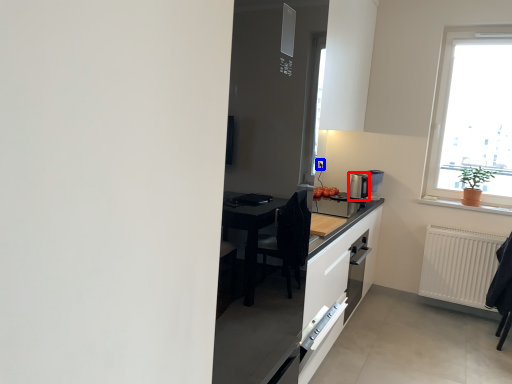
Question: Among these objects, which one is nearest to the camera, coffee machine (highlighted by a red box) or electric outlet (highlighted by a blue box)?

Choices:
 (A) coffee machine
 (B) electric outlet

Answer: (A)